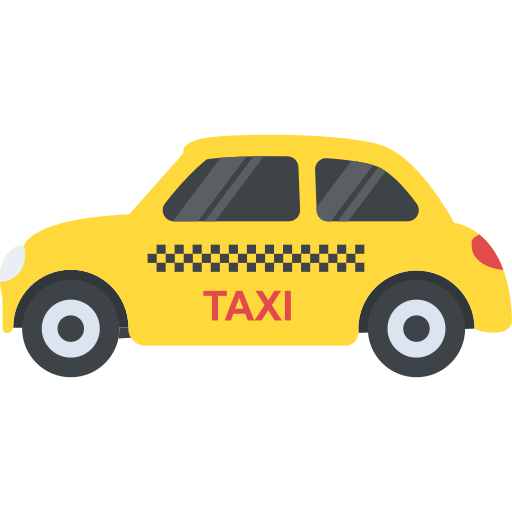
Find the location of a particular element. window is located at coordinates (243, 180), (361, 184).